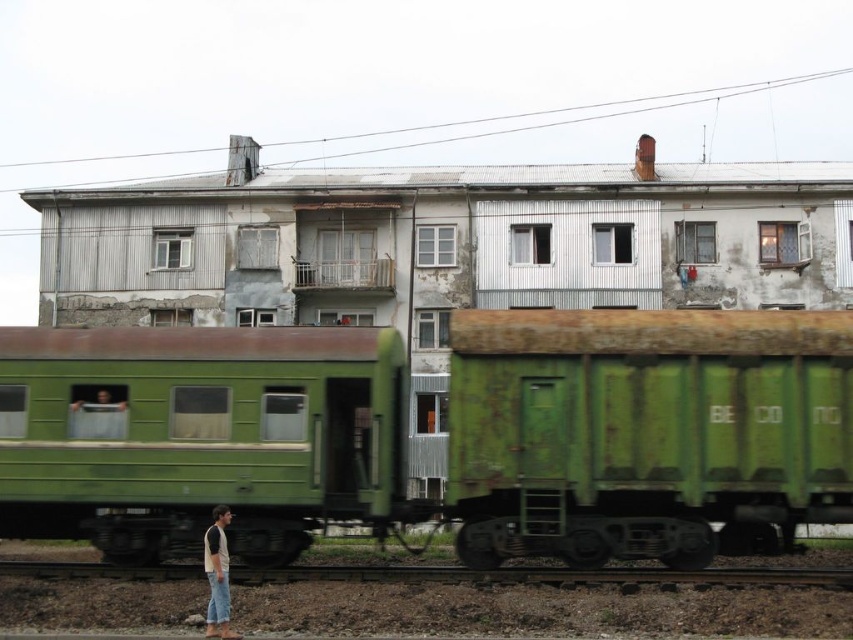
You are a railway inspector checking the tracks. You notice the smooth metal train track at lower center and the smooth green fabric at left. Which one is wider?

The smooth metal train track at lower center is wider than the smooth green fabric at left.

You are a photographer trying to capture a clear shot of the denim jeans at lower left and the rusty green metal train car at center. From your current position, can you see both objects fully without any obstruction?

The denim jeans at lower left is behind the rusty green metal train car at center, so you cannot see both objects fully without obstruction because the train car is blocking the view of the jeans.

Looking at this image, you are standing at the railway station and see the rusty green metal train car at center and the denim jeans at lower left. Which object is positioned to the right of the other?

The rusty green metal train car at center is to the right of denim jeans at lower left.